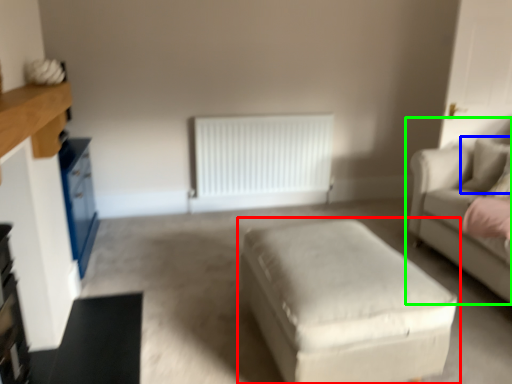
Question: Considering the real-world distances, which object is farthest from table (highlighted by a red box)? pillow (highlighted by a blue box) or studio couch (highlighted by a green box)?

Choices:
 (A) pillow
 (B) studio couch

Answer: (A)